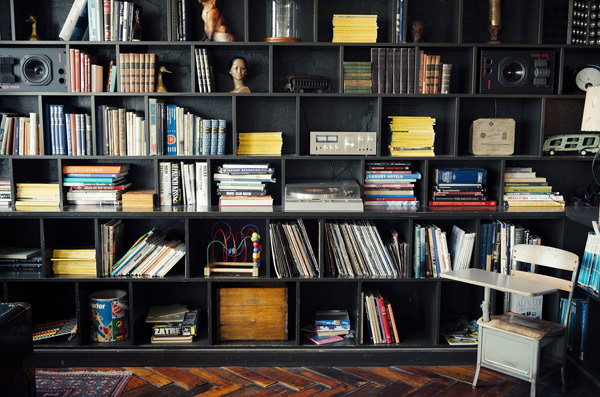
Locate an element on the screen. The image size is (600, 397). vertically shelved books on top shelf is located at coordinates (71, 19), (96, 22), (106, 22), (114, 11), (117, 30), (124, 20), (182, 24), (175, 25).